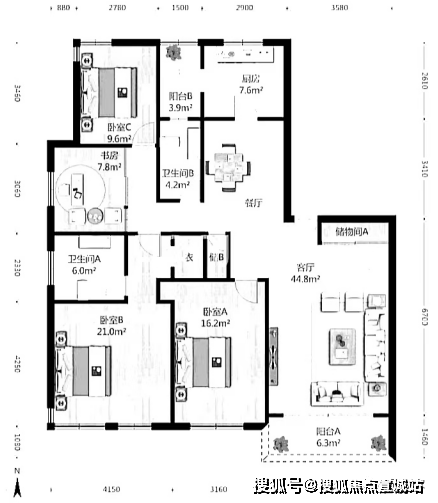
I want to click on apartment, so click(188, 236).